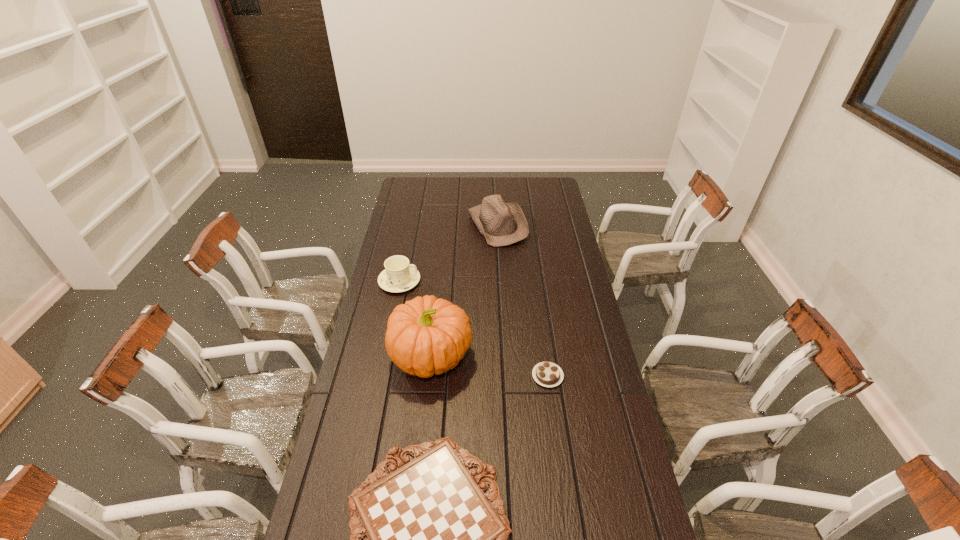
You are a GUI agent. You are given a task and a screenshot of the screen. Output one action in this format:
    pyautogui.click(x=<x>, y=<y>)
    Task: Click on the pumpkin present at the left edge
    The height and width of the screenshot is (540, 960).
    Given the screenshot: What is the action you would take?
    pyautogui.click(x=425, y=336)

At what (x,y) coordinates should I click in order to perform the action: click on chinaware that is at the left edge. Please return your answer as a coordinate pair (x, y). Image resolution: width=960 pixels, height=540 pixels. Looking at the image, I should click on (399, 276).

Locate an element on the screen. This screenshot has width=960, height=540. object present at the right edge is located at coordinates (548, 374).

The height and width of the screenshot is (540, 960). Find the location of `vacant space at the far edge`. vacant space at the far edge is located at coordinates (510, 188).

The height and width of the screenshot is (540, 960). In order to click on vacant space at the left edge of the desktop in this screenshot , I will do `click(418, 233)`.

I want to click on free spot at the right edge of the desktop, so click(546, 207).

This screenshot has width=960, height=540. Find the location of `vacant space that is in between the fourth tallest object and the chinaware`. vacant space that is in between the fourth tallest object and the chinaware is located at coordinates (473, 328).

What are the coordinates of `vacant area between the second tallest object and the tallest object` in the screenshot? It's located at (465, 291).

The width and height of the screenshot is (960, 540). I want to click on free space between the third tallest object and the fedora, so click(x=448, y=253).

Identify which object is the second closest to the chinaware. Please provide its 2D coordinates. Your answer should be formatted as a tuple, i.e. [(x, y)], where the tuple contains the x and y coordinates of a point satisfying the conditions above.

[(501, 223)]